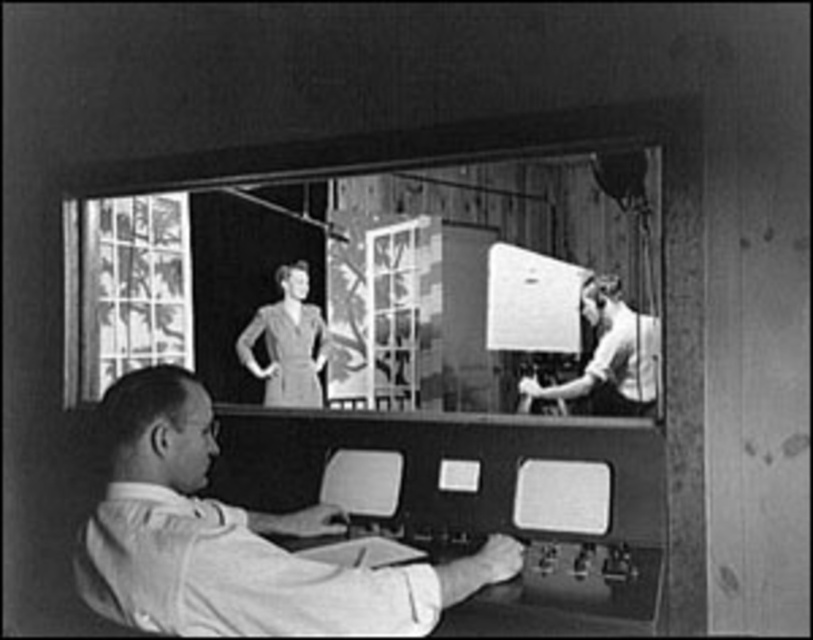
Question: Among these objects, which one is nearest to the camera?

Choices:
 (A) smooth white shirt at center
 (B) matte gray dress at center
 (C) smooth white shirt at upper right

Answer: (A)

Question: Among these points, which one is nearest to the camera?

Choices:
 (A) (112, 513)
 (B) (246, 360)

Answer: (A)

Question: Is smooth white shirt at upper right to the left of matte gray dress at center from the viewer's perspective?

Choices:
 (A) no
 (B) yes

Answer: (A)

Question: Observing the image, what is the correct spatial positioning of smooth white shirt at upper right in reference to matte gray dress at center?

Choices:
 (A) right
 (B) left

Answer: (A)

Question: Which of the following is the closest to the observer?

Choices:
 (A) matte gray dress at center
 (B) smooth white shirt at center

Answer: (B)

Question: Is smooth white shirt at center positioned before smooth white shirt at upper right?

Choices:
 (A) no
 (B) yes

Answer: (B)